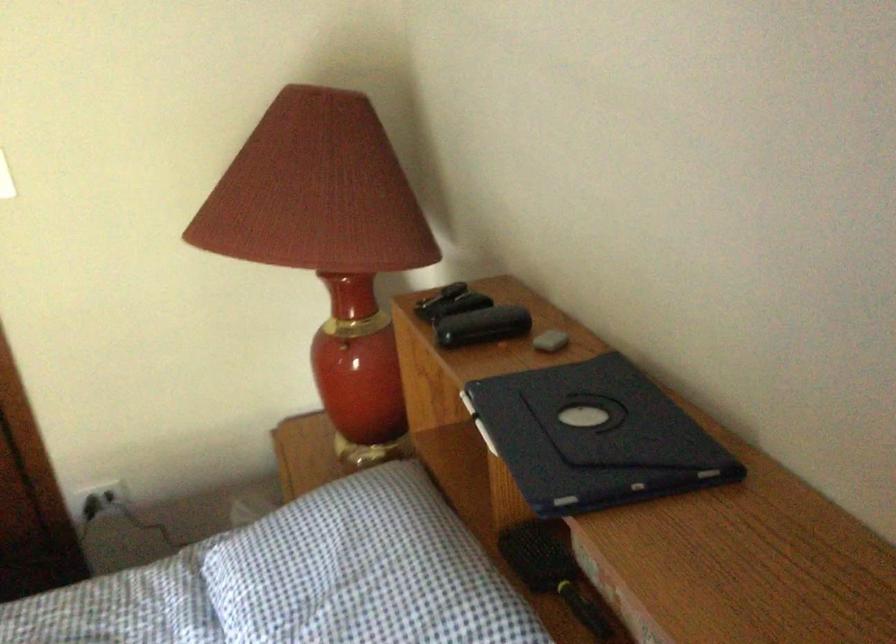
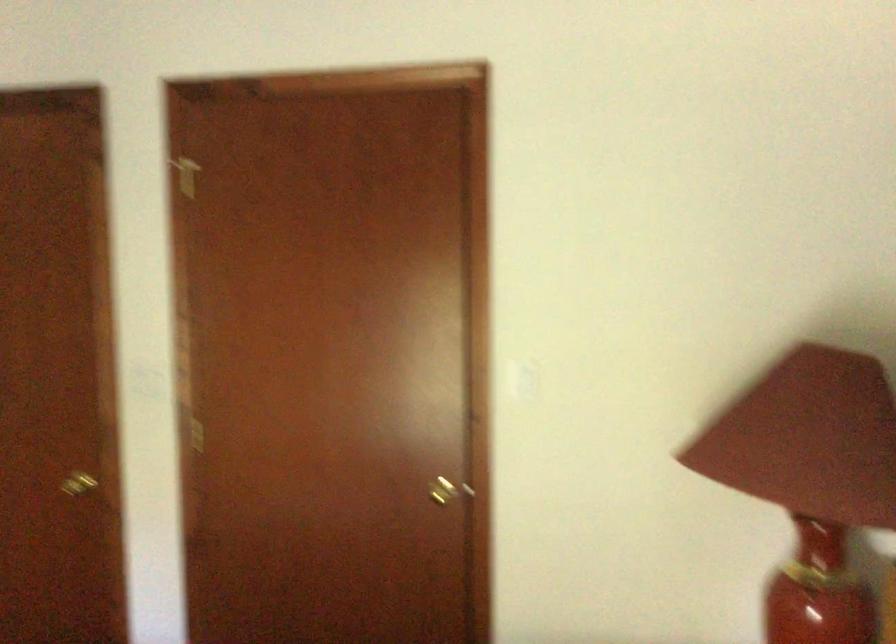
Question: The camera is either moving clockwise (left) or counter-clockwise (right) around the object. The first image is from the beginning of the video and the second image is from the end. Is the camera moving left or right when shooting the video?

Choices:
 (A) Left
 (B) Right

Answer: (B)